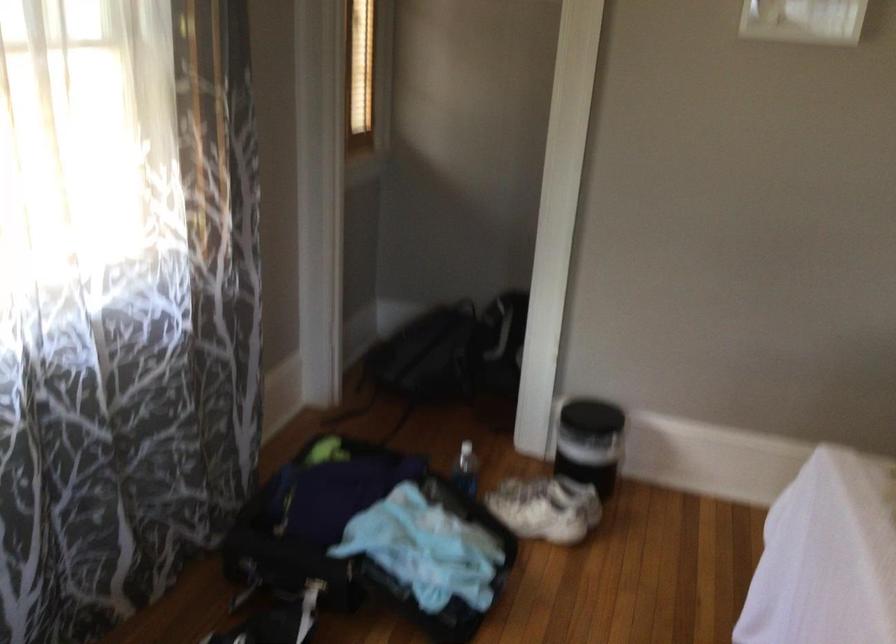
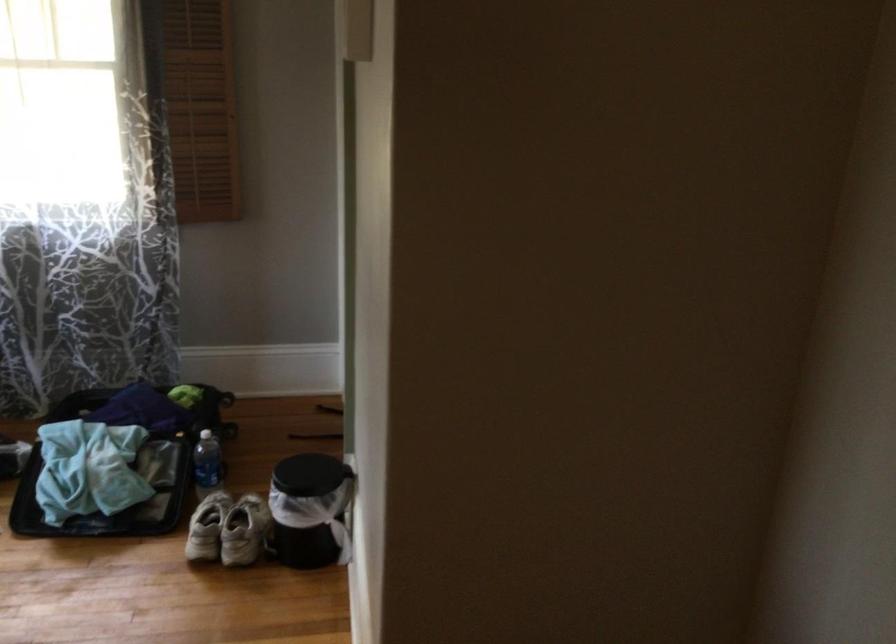
In the second image, find the point that corresponds to the point at 487,540 in the first image.

(110, 491)